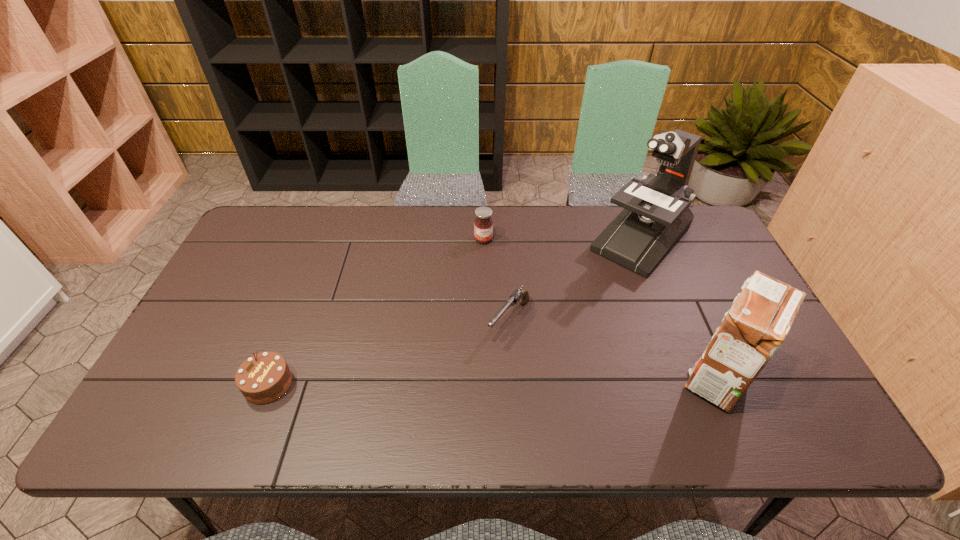
The height and width of the screenshot is (540, 960). I want to click on chocolate cake situated at the near edge, so click(265, 377).

Where is `carton at the near edge`? Image resolution: width=960 pixels, height=540 pixels. carton at the near edge is located at coordinates (756, 325).

Where is `carton present at the right edge`? This screenshot has width=960, height=540. carton present at the right edge is located at coordinates (756, 325).

Find the location of a particular element. The height and width of the screenshot is (540, 960). microscope that is at the right edge is located at coordinates (656, 214).

You are a GUI agent. You are given a task and a screenshot of the screen. Output one action in this format:
    pyautogui.click(x=<x>, y=<y>)
    Task: Click on the object situated at the far right corner
    This screenshot has width=960, height=540.
    Given the screenshot: What is the action you would take?
    pyautogui.click(x=656, y=214)

At what (x,y) coordinates should I click in order to perform the action: click on object that is positioned at the near right corner. Please return your answer as a coordinate pair (x, y). The image size is (960, 540). Looking at the image, I should click on (756, 325).

Where is `vacant area at the far edge`? This screenshot has width=960, height=540. vacant area at the far edge is located at coordinates (511, 232).

The width and height of the screenshot is (960, 540). Identify the location of vacant space at the left edge of the desktop. (245, 318).

Locate an element on the screen. The image size is (960, 540). blank space at the right edge of the desktop is located at coordinates (722, 305).

Find the location of a particular element. The width and height of the screenshot is (960, 540). vacant space at the far left corner is located at coordinates (288, 244).